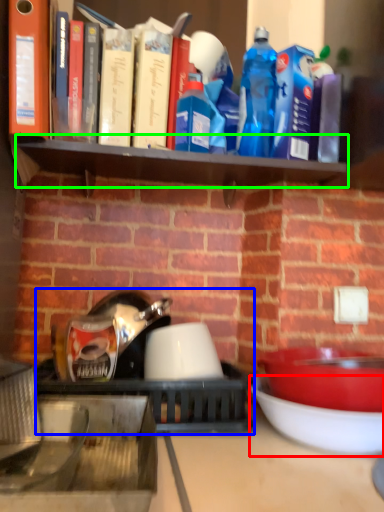
Question: Which object is positioned closest to bowl (highlighted by a red box)? Select from appliance (highlighted by a blue box) and shelf (highlighted by a green box).

Choices:
 (A) appliance
 (B) shelf

Answer: (A)